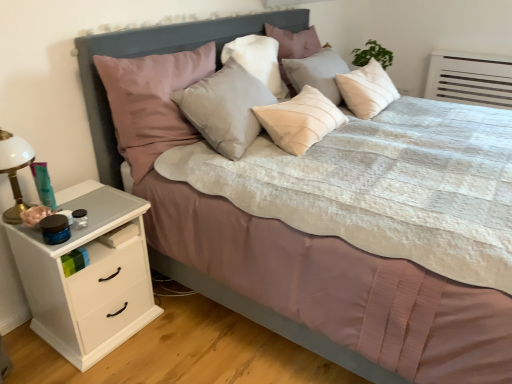
Find the location of `free point above white matte chest of drawers at left (from a real-world perspective)`. free point above white matte chest of drawers at left (from a real-world perspective) is located at coordinates (84, 205).